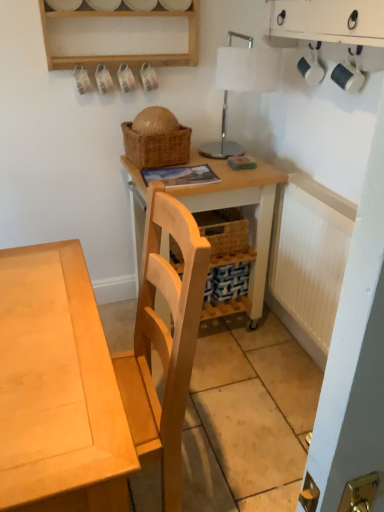
Question: Considering the relative sizes of woven brown picnic basket at upper center and light wood desk at center in the image provided, is woven brown picnic basket at upper center taller than light wood desk at center?

Choices:
 (A) yes
 (B) no

Answer: (B)

Question: Is light wood desk at center at the back of woven brown picnic basket at upper center?

Choices:
 (A) yes
 (B) no

Answer: (B)

Question: Is woven brown picnic basket at upper center positioned far away from light wood desk at center?

Choices:
 (A) yes
 (B) no

Answer: (B)

Question: From a real-world perspective, is woven brown picnic basket at upper center positioned over light wood desk at center based on gravity?

Choices:
 (A) yes
 (B) no

Answer: (A)

Question: Does woven brown picnic basket at upper center have a lesser width compared to light wood desk at center?

Choices:
 (A) no
 (B) yes

Answer: (B)

Question: Could you tell me if woven brown picnic basket at upper center is turned towards light wood desk at center?

Choices:
 (A) no
 (B) yes

Answer: (A)

Question: Is wooden table at center positioned before woven brown picnic basket at upper center?

Choices:
 (A) yes
 (B) no

Answer: (A)

Question: From the image's perspective, is wooden table at center beneath woven brown picnic basket at upper center?

Choices:
 (A) yes
 (B) no

Answer: (A)

Question: Is wooden table at center smaller than woven brown picnic basket at upper center?

Choices:
 (A) yes
 (B) no

Answer: (B)

Question: From the image's perspective, is wooden table at center above woven brown picnic basket at upper center?

Choices:
 (A) no
 (B) yes

Answer: (A)

Question: Is wooden table at center aimed at woven brown picnic basket at upper center?

Choices:
 (A) no
 (B) yes

Answer: (A)

Question: Are wooden table at center and woven brown picnic basket at upper center making contact?

Choices:
 (A) no
 (B) yes

Answer: (A)

Question: Is white glossy table lamp at upper center to the right of woven brown picnic basket at upper center from the viewer's perspective?

Choices:
 (A) no
 (B) yes

Answer: (B)